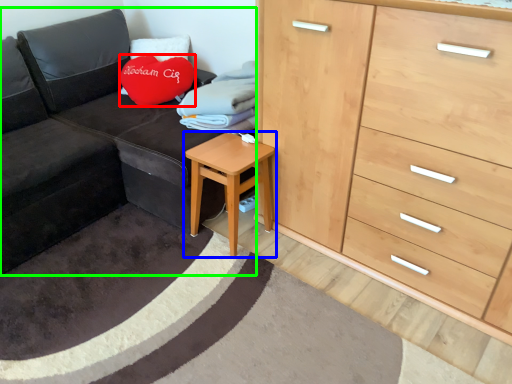
Question: Considering the real-world distances, which object is farthest from throw pillow (highlighted by a red box)? table (highlighted by a blue box) or studio couch (highlighted by a green box)?

Choices:
 (A) table
 (B) studio couch

Answer: (A)